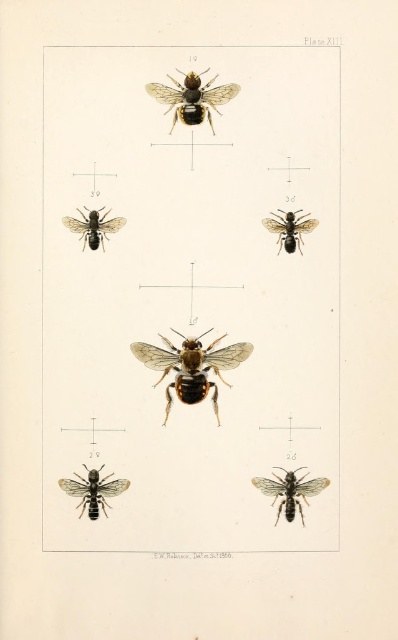
You are an entomologist examining the scientific illustration labeled as Plate XIII. You notice two insects in the image. One is the black matte bee at upper center and the other is the black matte wasp at lower right. Based on their positions in the illustration, which insect is located higher up?

The black matte bee at upper center is located higher up than the black matte wasp at lower right.

You are an entomologist examining the scientific illustration labeled Plate XIII. You notice two insects in the image. The first is the black matte bee at upper center, and the second is the black matte wasp at lower right. Based on their positions in the illustration, which insect appears taller?

The black matte bee at upper center is much taller than the black matte wasp at lower right.